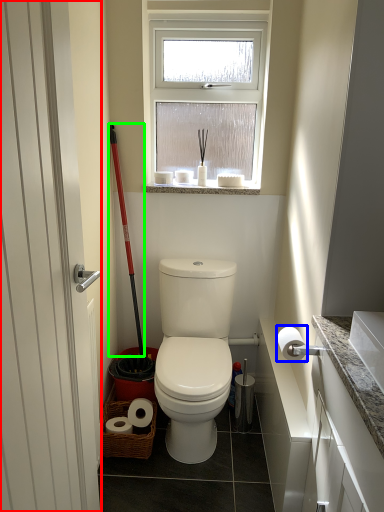
Question: Considering the real-world distances, which object is closest to screen door (highlighted by a red box)? toilet paper (highlighted by a blue box) or ski pole (highlighted by a green box).

Choices:
 (A) toilet paper
 (B) ski pole

Answer: (A)